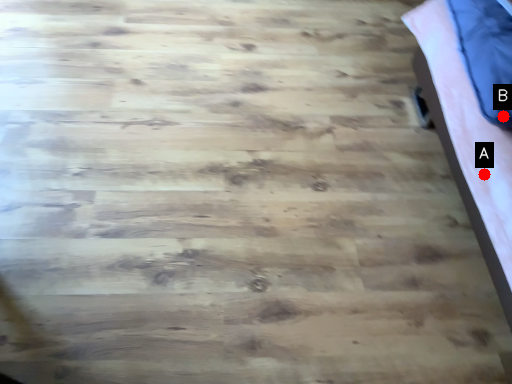
Question: Two points are circled on the image, labeled by A and B beside each circle. Which point is further to the camera?

Choices:
 (A) A is further
 (B) B is further

Answer: (A)